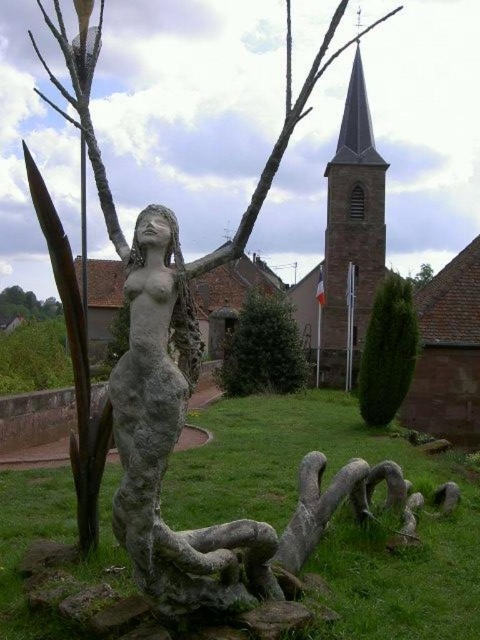
Does point (248, 540) lie behind point (369, 337)?

No, (248, 540) is closer to viewer.

Is point (143, 486) closer to viewer compared to point (371, 388)?

That is True.

At what (x,y) coordinates should I click in order to perform the action: click on gray stone statue at center. Please return your answer as a coordinate pair (x, y). Looking at the image, I should click on (170, 440).

Does green textured tree at center right have a greater width compared to green leafy tree at upper left?

No.

Who is taller, green textured tree at center right or green leafy tree at upper left?

green leafy tree at upper left

Is point (381, 301) closer to camera compared to point (9, 321)?

That is True.

Find the location of a particular element. This screenshot has height=640, width=480. green textured tree at center right is located at coordinates (387, 353).

Who is more distant from viewer, (8,595) or (260,541)?

Positioned behind is point (8,595).

Is green grass at center below gray stone statue at center?

Correct, green grass at center is located below gray stone statue at center.

Is point (471, 637) in front of point (190, 529)?

Yes, it is in front of point (190, 529).

Image resolution: width=480 pixels, height=640 pixels. Identify the location of green grass at center. (337, 513).